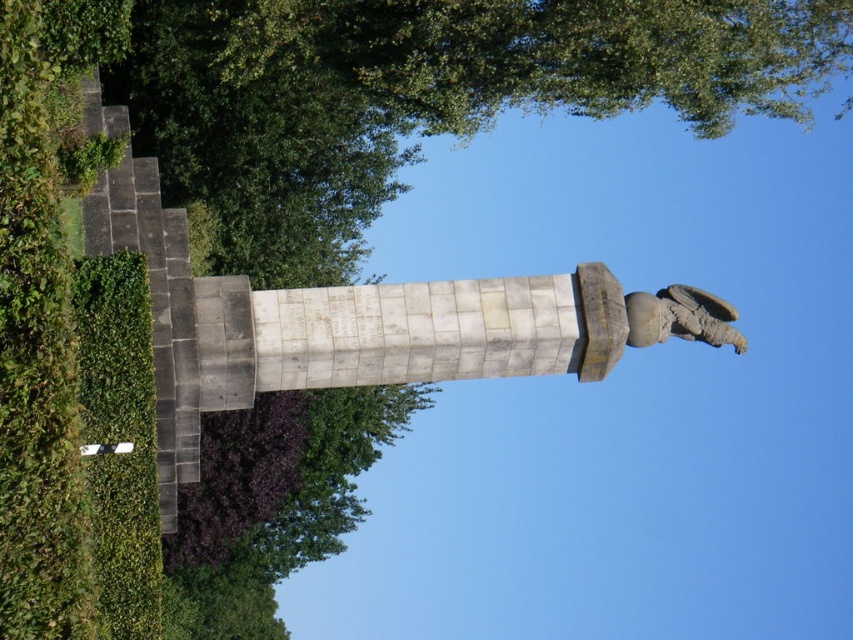
You are a gardener planning to trim the green leafy tree at upper center and the stone statue at upper right. Based on their positions, which object is located higher in the image?

The green leafy tree at upper center is positioned over the stone statue at upper right, so it is higher in the image.

Based on the photo, you are standing in front of the stone monument and notice a green leafy tree at upper center and a stone statue at upper right. Which object is closer to you?

The green leafy tree at upper center is closer to you because it is in front of the stone statue at upper right.